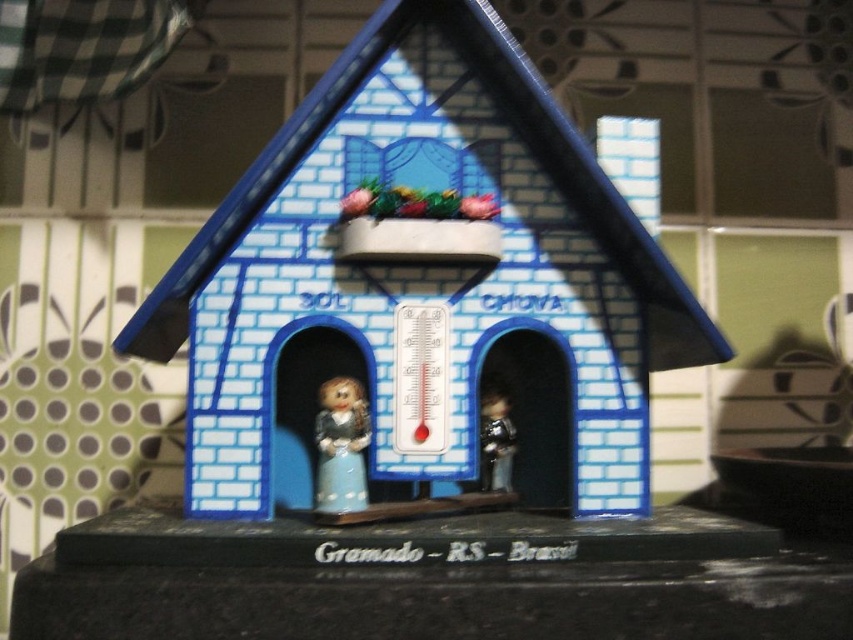
Does blue painted wood thermometer at center have a larger size compared to matte porcelain doll at lower left?

Yes.

Describe the element at coordinates (421, 273) in the screenshot. I see `blue painted wood thermometer at center` at that location.

Who is more forward, (270, 244) or (334, 403)?

Point (334, 403) is more forward.

Locate an element on the screen. This screenshot has width=853, height=640. blue painted wood thermometer at center is located at coordinates (421, 273).

Between matte porcelain doll at lower left and metallic silver figurine at center, which one appears on the right side from the viewer's perspective?

Positioned to the right is metallic silver figurine at center.

In the scene shown: Who is more distant from viewer, (323,387) or (509,452)?

The point (509,452) is behind.

Does point (341, 442) lie in front of point (492, 410)?

Yes, point (341, 442) is closer to viewer.

At what (x,y) coordinates should I click in order to perform the action: click on matte porcelain doll at lower left. Please return your answer as a coordinate pair (x, y). Looking at the image, I should click on (341, 445).

Can you confirm if blue painted wood thermometer at center is taller than metallic silver figurine at center?

Correct, blue painted wood thermometer at center is much taller as metallic silver figurine at center.

The image size is (853, 640). I want to click on blue painted wood thermometer at center, so click(421, 273).

Identify the location of blue painted wood thermometer at center. This screenshot has width=853, height=640. (421, 273).